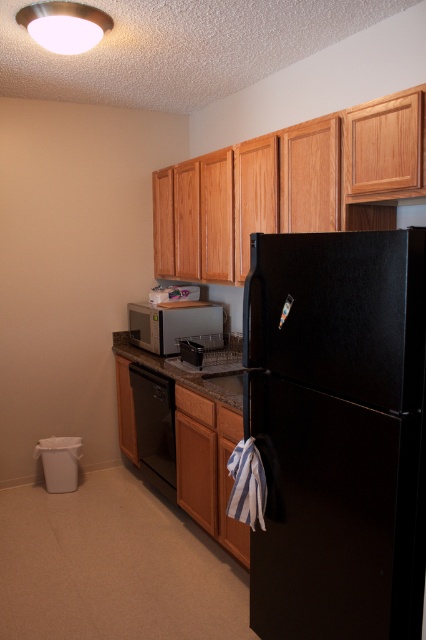
Is black matte refrigerator at center bigger than granite/black at center?

Yes, black matte refrigerator at center is bigger than granite/black at center.

Who is positioned more to the left, black matte refrigerator at center or granite/black at center?

granite/black at center

I want to click on black matte refrigerator at center, so click(337, 433).

Where is `black matte refrigerator at center`? black matte refrigerator at center is located at coordinates (337, 433).

Is black matte refrigerator at center thinner than satin silver microwave at center?

Correct, black matte refrigerator at center's width is less than satin silver microwave at center's.

Looking at this image, is black matte refrigerator at center taller than satin silver microwave at center?

Yes.

At what (x,y) coordinates should I click in order to perform the action: click on black matte refrigerator at center. Please return your answer as a coordinate pair (x, y). The height and width of the screenshot is (640, 426). Looking at the image, I should click on (337, 433).

Does black matte dishwasher at lower center have a lesser width compared to satin silver microwave at center?

Yes, black matte dishwasher at lower center is thinner than satin silver microwave at center.

Between point (163, 474) and point (195, 304), which one is positioned in front?

Point (163, 474) is more forward.

Between point (152, 380) and point (181, 336), which one is positioned behind?

The point (181, 336) is behind.

The height and width of the screenshot is (640, 426). I want to click on black matte dishwasher at lower center, so (x=155, y=426).